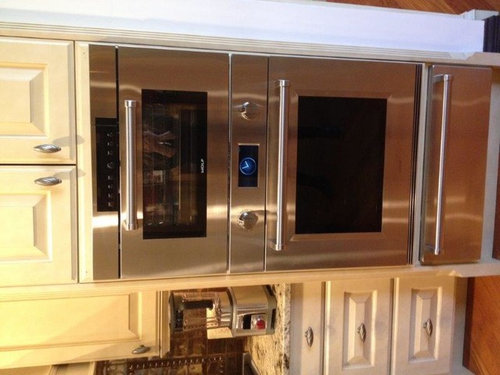
Locate an element on the screen. The image size is (500, 375). digital clock is located at coordinates (247, 169).